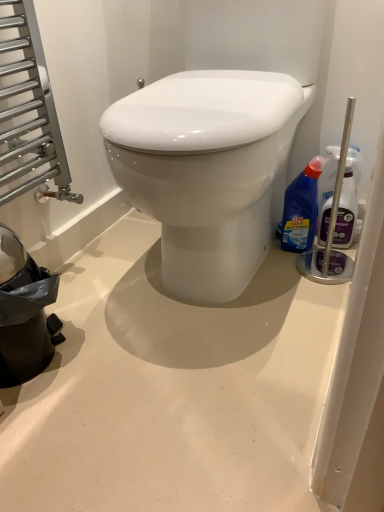
Question: Is purple plastic cleaner at right, acting as the 2th bottle starting from the left, at the back of blue plastic bottle at right, which appears as the 2th bottle when viewed from the right?

Choices:
 (A) no
 (B) yes

Answer: (A)

Question: Can you confirm if blue plastic bottle at right, which is the first bottle in left-to-right order, is positioned to the right of purple plastic cleaner at right, acting as the 2th bottle starting from the left?

Choices:
 (A) no
 (B) yes

Answer: (A)

Question: Can you confirm if blue plastic bottle at right, which is the first bottle in left-to-right order, is shorter than purple plastic cleaner at right, which appears as the 1th bottle when viewed from the right?

Choices:
 (A) no
 (B) yes

Answer: (B)

Question: Does blue plastic bottle at right, which appears as the 2th bottle when viewed from the right, have a greater height compared to purple plastic cleaner at right, which appears as the 1th bottle when viewed from the right?

Choices:
 (A) no
 (B) yes

Answer: (A)

Question: Can we say blue plastic bottle at right, which is the first bottle in left-to-right order, lies outside purple plastic cleaner at right, acting as the 2th bottle starting from the left?

Choices:
 (A) no
 (B) yes

Answer: (B)

Question: Can you confirm if blue plastic bottle at right, which appears as the 2th bottle when viewed from the right, is bigger than purple plastic cleaner at right, which appears as the 1th bottle when viewed from the right?

Choices:
 (A) yes
 (B) no

Answer: (A)

Question: Is purple plastic cleaner at right, which appears as the 1th bottle when viewed from the right, outside blue plastic bottle at right, which appears as the 2th bottle when viewed from the right?

Choices:
 (A) yes
 (B) no

Answer: (A)

Question: Are purple plastic cleaner at right, acting as the 2th bottle starting from the left, and blue plastic bottle at right, which is the first bottle in left-to-right order, making contact?

Choices:
 (A) yes
 (B) no

Answer: (A)

Question: Is purple plastic cleaner at right, acting as the 2th bottle starting from the left, looking in the opposite direction of blue plastic bottle at right, which is the first bottle in left-to-right order?

Choices:
 (A) no
 (B) yes

Answer: (A)

Question: From a real-world perspective, is purple plastic cleaner at right, which appears as the 1th bottle when viewed from the right, physically below blue plastic bottle at right, which appears as the 2th bottle when viewed from the right?

Choices:
 (A) yes
 (B) no

Answer: (B)

Question: Is purple plastic cleaner at right, acting as the 2th bottle starting from the left, at the right side of blue plastic bottle at right, which appears as the 2th bottle when viewed from the right?

Choices:
 (A) yes
 (B) no

Answer: (A)

Question: Is purple plastic cleaner at right, which appears as the 1th bottle when viewed from the right, shorter than blue plastic bottle at right, which is the first bottle in left-to-right order?

Choices:
 (A) no
 (B) yes

Answer: (A)

Question: From the image's perspective, relative to blue plastic bottle at right, which appears as the 2th bottle when viewed from the right, is purple plastic cleaner at right, which appears as the 1th bottle when viewed from the right, above or below?

Choices:
 (A) above
 (B) below

Answer: (A)